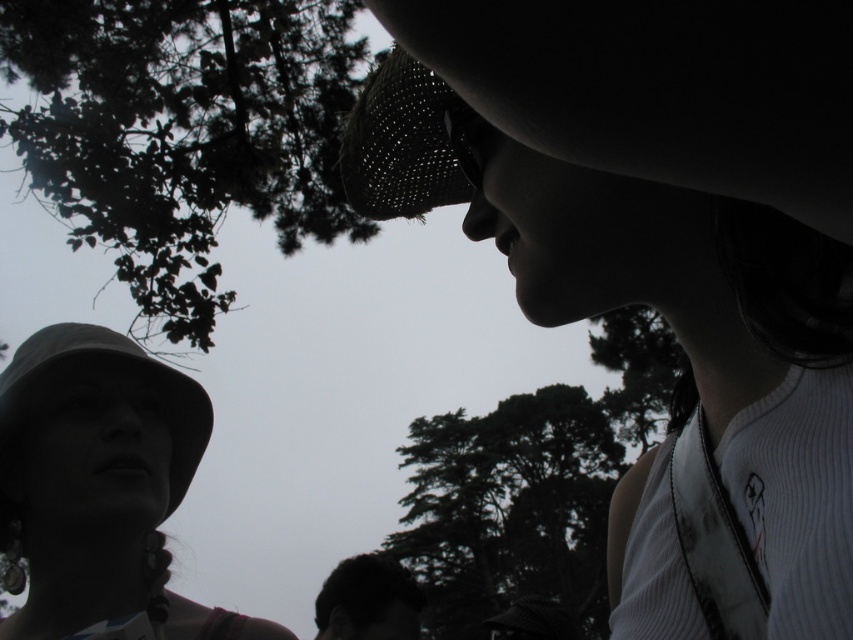
Is matte white hat at upper right to the left of matte white hat at lower left from the viewer's perspective?

No, matte white hat at upper right is not to the left of matte white hat at lower left.

Is point (848, 337) farther from camera compared to point (161, 372)?

No.

You are a GUI agent. You are given a task and a screenshot of the screen. Output one action in this format:
    pyautogui.click(x=<x>, y=<y>)
    Task: Click on the matte white hat at upper right
    Image resolution: width=853 pixels, height=640 pixels.
    Given the screenshot: What is the action you would take?
    pyautogui.click(x=680, y=342)

Which is in front, point (202, 440) or point (380, 72)?

Point (380, 72) is more forward.

The image size is (853, 640). What are the coordinates of `matte white hat at left` in the screenshot? It's located at (91, 468).

You are a GUI agent. You are given a task and a screenshot of the screen. Output one action in this format:
    pyautogui.click(x=<x>, y=<y>)
    Task: Click on the matte white hat at left
    
    Given the screenshot: What is the action you would take?
    pyautogui.click(x=91, y=468)

Who is shorter, green leafy tree at center or dark brown hair at lower center?

Standing shorter between the two is dark brown hair at lower center.

Between point (527, 556) and point (335, 592), which one is positioned in front?

Positioned in front is point (335, 592).

Locate an element on the screen. green leafy tree at center is located at coordinates (509, 509).

This screenshot has width=853, height=640. What are the coordinates of `green leafy tree at center` in the screenshot? It's located at (509, 509).